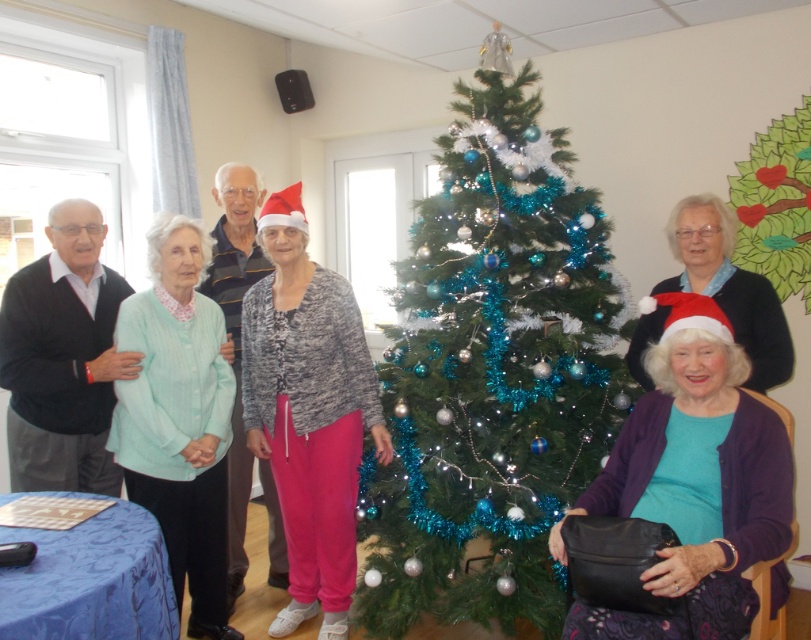
Question: Among these objects, which one is farthest from the camera?

Choices:
 (A) black sweater at left
 (B) gray knit sweater at center
 (C) matte black sweater at center
 (D) light green knitted sweater at left

Answer: (B)

Question: Is green artificial christmas tree at center wider than gray knit sweater at center?

Choices:
 (A) no
 (B) yes

Answer: (B)

Question: Which point appears farthest from the camera in this image?

Choices:
 (A) (230, 365)
 (B) (298, 556)
 (C) (460, 534)
 (D) (183, 294)

Answer: (B)

Question: Does green artificial christmas tree at center have a larger size compared to black sweater at left?

Choices:
 (A) yes
 (B) no

Answer: (A)

Question: Which point is closer to the camera taking this photo?

Choices:
 (A) (132, 496)
 (B) (105, 284)
 (C) (651, 436)

Answer: (C)

Question: Is purple soft sweater at center above matte black sweater at center?

Choices:
 (A) no
 (B) yes

Answer: (A)